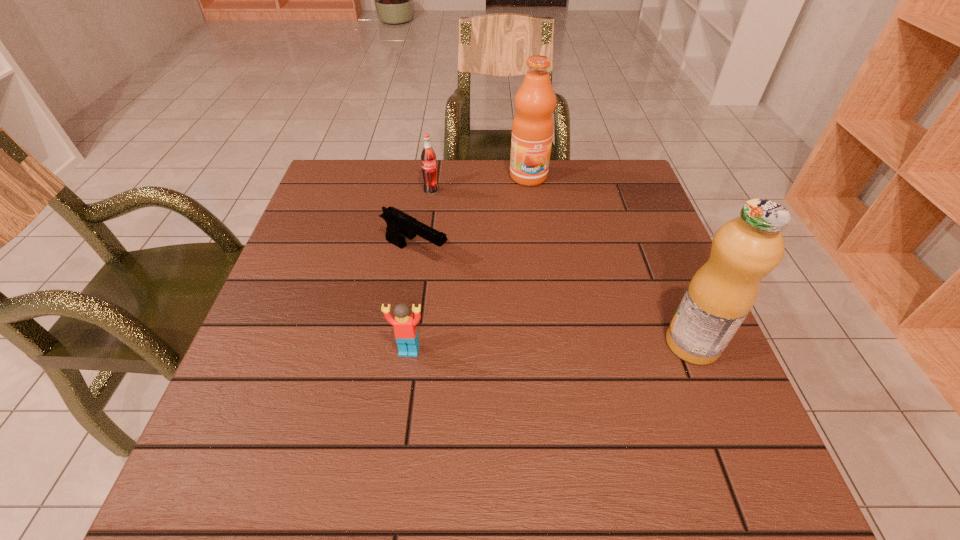
Identify the location of vacant spot on the desktop that is between the fourth tallest object and the rightmost object and is positioned on the label side of the left fruit juice. (589, 346).

The width and height of the screenshot is (960, 540). Identify the location of vacant spot on the desktop that is between the Lego and the nearer fruit juice and is positioned on the label of the third shortest object. (549, 347).

I want to click on vacant space on the desktop that is between the fourth tallest object and the rightmost object and is positioned on the front-facing side of the pistol, so (585, 346).